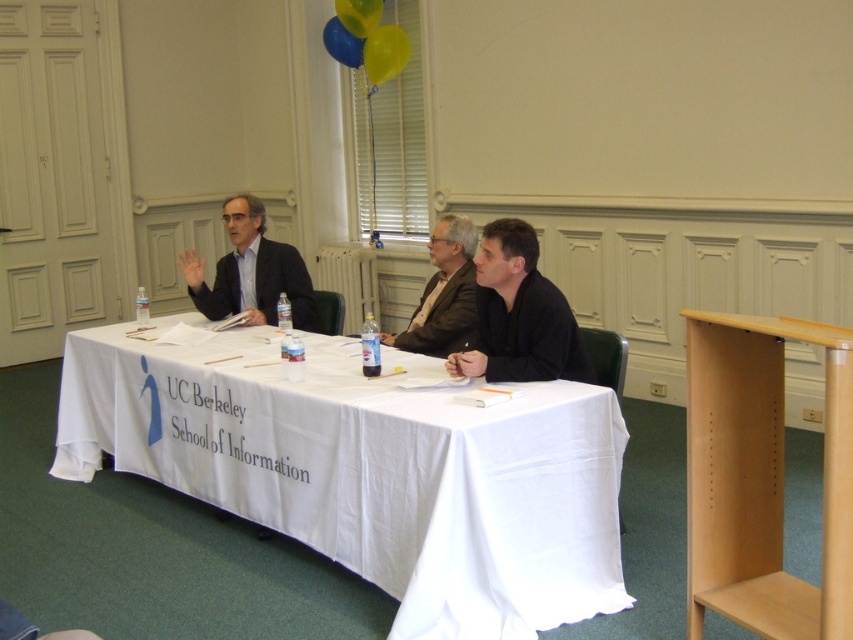
Does white cloth-covered table at center come behind rubber yellow balloon at upper center?

No, it is not.

Describe the element at coordinates (368, 468) in the screenshot. I see `white cloth-covered table at center` at that location.

This screenshot has height=640, width=853. I want to click on white cloth-covered table at center, so (368, 468).

Can you confirm if dark brown leather jacket at center is positioned to the left of rubberized blue balloon at upper center?

No, dark brown leather jacket at center is not to the left of rubberized blue balloon at upper center.

Does point (395, 337) come closer to viewer compared to point (341, 26)?

Yes, it is.

I want to click on dark brown leather jacket at center, so click(444, 292).

Is white cloth-covered table at center shorter than rubberized blue balloon at upper center?

Incorrect, white cloth-covered table at center's height does not fall short of rubberized blue balloon at upper center's.

Can you confirm if white cloth-covered table at center is bigger than rubberized blue balloon at upper center?

Indeed, white cloth-covered table at center has a larger size compared to rubberized blue balloon at upper center.

What do you see at coordinates (368, 468) in the screenshot? The image size is (853, 640). I see `white cloth-covered table at center` at bounding box center [368, 468].

Identify the location of white cloth-covered table at center. The image size is (853, 640). (368, 468).